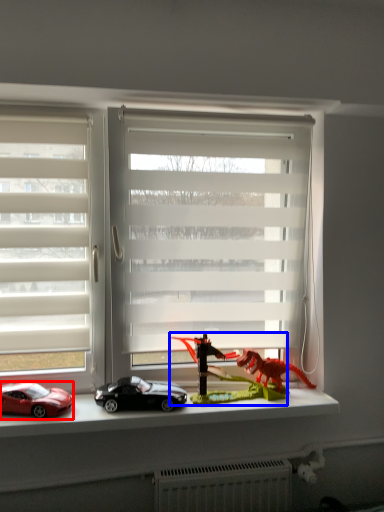
Question: Which point is further to the camera, car (highlighted by a red box) or toy (highlighted by a blue box)?

Choices:
 (A) car
 (B) toy

Answer: (B)